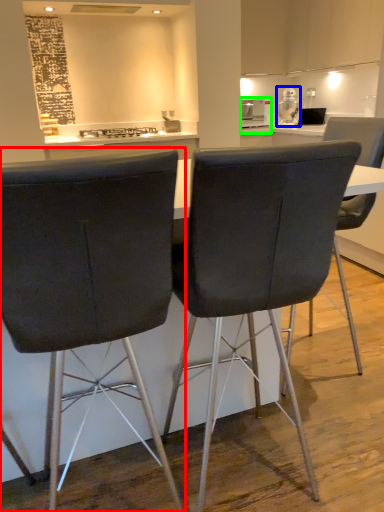
Question: Which object is the farthest from chair (highlighted by a red box)? Choose among these: appliance (highlighted by a blue box) or appliance (highlighted by a green box).

Choices:
 (A) appliance
 (B) appliance

Answer: (A)